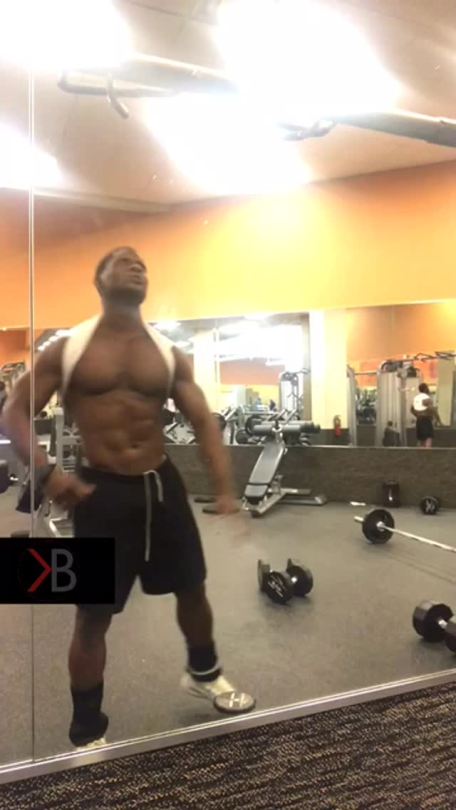
Where is `mirrors`? Image resolution: width=456 pixels, height=810 pixels. mirrors is located at coordinates pos(427,363), pos(285,355), pos(14,334).